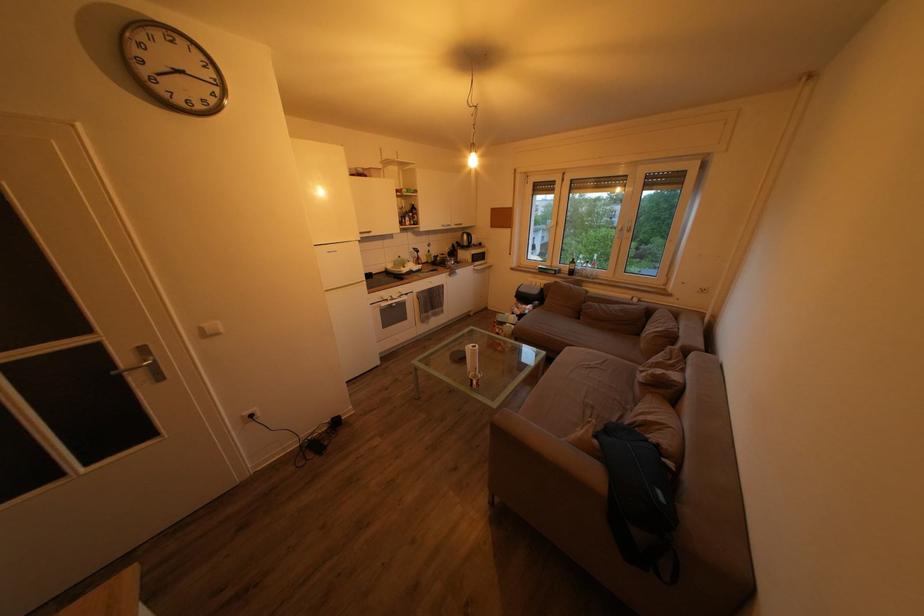
In order to click on white window handle in this screenshot , I will do `click(626, 230)`.